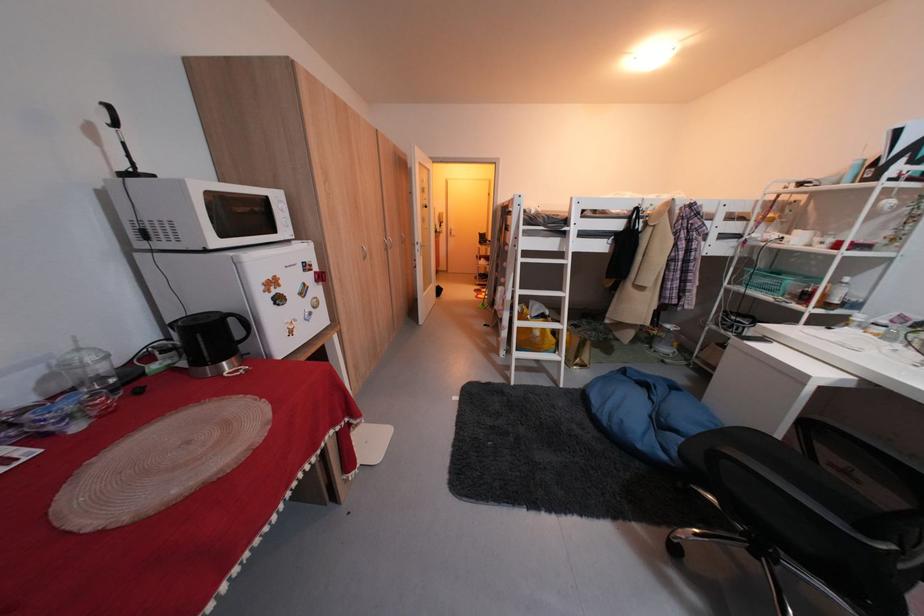
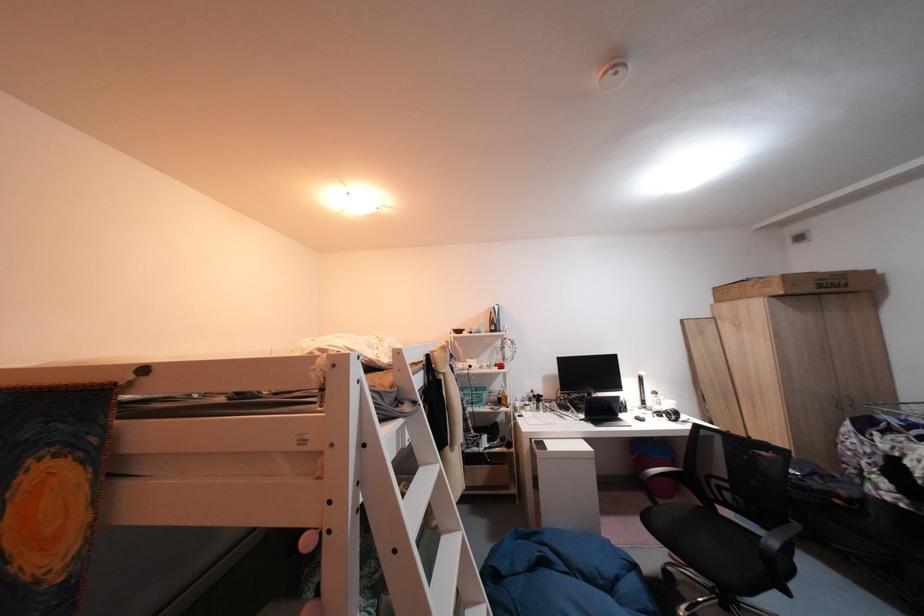
The point at [703,264] is marked in the first image. Where is the corresponding point in the second image?

(475, 400)